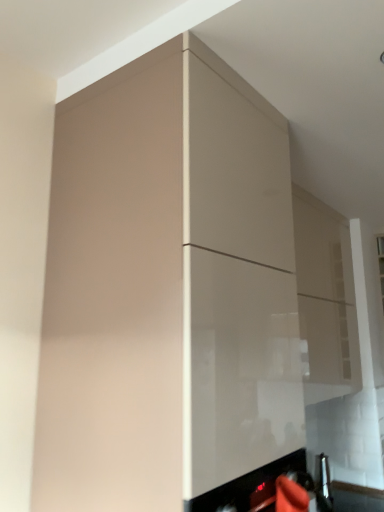
Question: Considering the positions of point (337, 284) and point (153, 263), is point (337, 284) closer or farther from the camera than point (153, 263)?

Choices:
 (A) farther
 (B) closer

Answer: (A)

Question: Considering their positions, is glossy beige cabinet at upper center, which appears as the first cabinetry when viewed from the back, located in front of or behind matte beige cabinet at center, acting as the 2th cabinetry starting from the right?

Choices:
 (A) front
 (B) behind

Answer: (B)

Question: Is glossy beige cabinet at upper center, which is the 2th cabinetry in front-to-back order, spatially inside matte beige cabinet at center, the second cabinetry from the back, or outside of it?

Choices:
 (A) outside
 (B) inside

Answer: (A)

Question: Considering the positions of point (188, 53) and point (336, 263), is point (188, 53) closer or farther from the camera than point (336, 263)?

Choices:
 (A) farther
 (B) closer

Answer: (B)

Question: Looking at the image, does matte beige cabinet at center, the second cabinetry from the back, seem bigger or smaller compared to glossy beige cabinet at upper center, the first cabinetry in the right-to-left sequence?

Choices:
 (A) small
 (B) big

Answer: (B)

Question: Considering the positions of matte beige cabinet at center, the first cabinetry from the left, and glossy beige cabinet at upper center, the first cabinetry in the right-to-left sequence, in the image, is matte beige cabinet at center, the first cabinetry from the left, wider or thinner than glossy beige cabinet at upper center, the first cabinetry in the right-to-left sequence,?

Choices:
 (A) thin
 (B) wide

Answer: (B)

Question: Is matte beige cabinet at center, acting as the 2th cabinetry starting from the right, inside or outside of glossy beige cabinet at upper center, which appears as the first cabinetry when viewed from the back?

Choices:
 (A) outside
 (B) inside

Answer: (A)